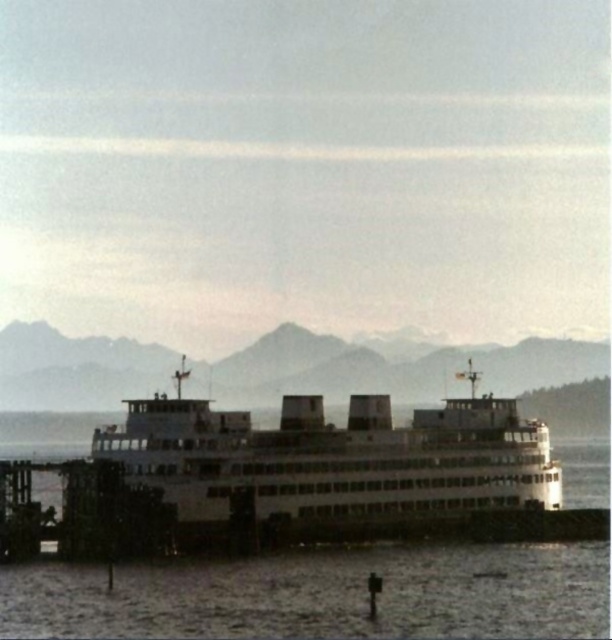
Question: Is white matte ferry at center to the left of white matte water at center from the viewer's perspective?

Choices:
 (A) no
 (B) yes

Answer: (B)

Question: Considering the relative positions of white matte ferry at center and white matte water at center in the image provided, where is white matte ferry at center located with respect to white matte water at center?

Choices:
 (A) left
 (B) right

Answer: (A)

Question: Does white matte ferry at center come in front of white matte water at center?

Choices:
 (A) no
 (B) yes

Answer: (A)

Question: Which point is farther from the camera taking this photo?

Choices:
 (A) (75, 598)
 (B) (192, 492)

Answer: (B)